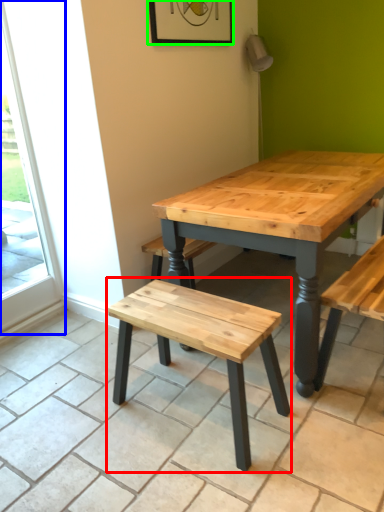
Question: Estimate the real-world distances between objects in this image. Which object is farther from stool (highlighted by a red box), screen door (highlighted by a blue box) or picture frame (highlighted by a green box)?

Choices:
 (A) screen door
 (B) picture frame

Answer: (B)